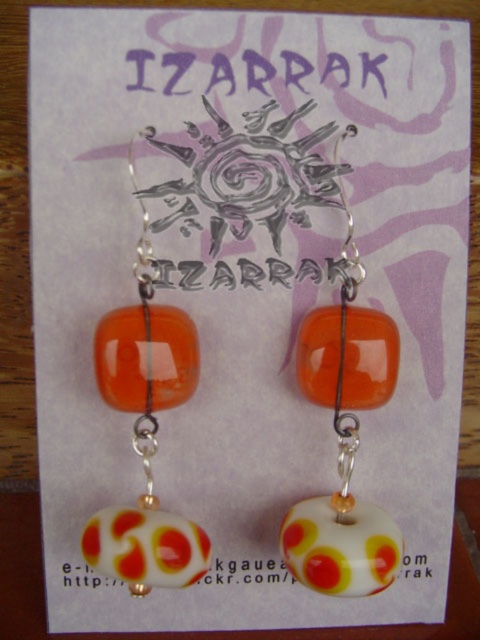
Is orange glossy bead at center positioned in front of orange glass bead at center?

Yes, orange glossy bead at center is closer to the viewer.

Does orange glossy bead at center have a greater height compared to orange glass bead at center?

In fact, orange glossy bead at center may be shorter than orange glass bead at center.

I want to click on orange glossy bead at center, so click(x=344, y=436).